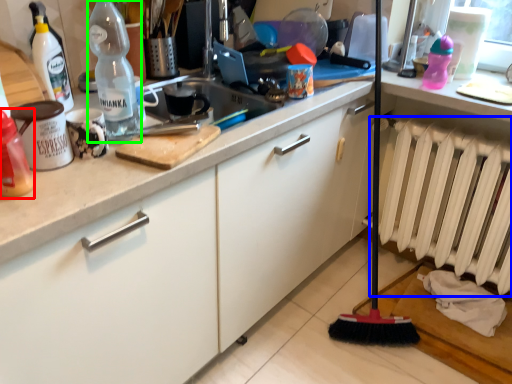
Question: Considering the real-world distances, which object is closest to bottle (highlighted by a red box)? radiator (highlighted by a blue box) or bottle (highlighted by a green box).

Choices:
 (A) radiator
 (B) bottle

Answer: (B)